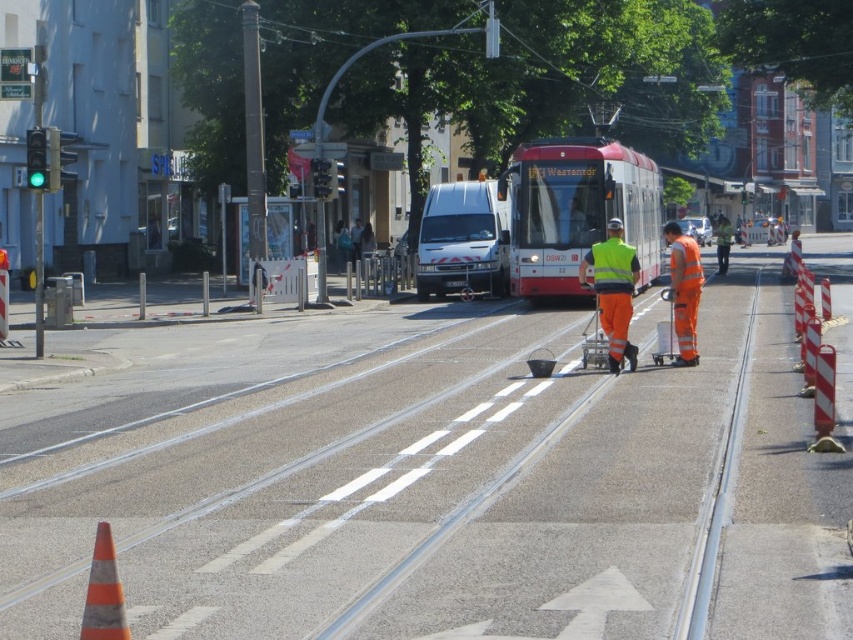
Question: Is the position of orange reflective workwear at center more distant than that of metallic silver trolley at center?

Choices:
 (A) no
 (B) yes

Answer: (A)

Question: Which object appears closest to the camera in this image?

Choices:
 (A) orange striped cone at lower left
 (B) high visibility orange reflective pants at center
 (C) yellow reflective safety vest at center

Answer: (A)

Question: Which point appears farthest from the camera in this image?

Choices:
 (A) (686, 301)
 (B) (94, 589)
 (C) (660, 344)
 (D) (583, 340)

Answer: (D)

Question: Among these objects, which one is farthest from the camera?

Choices:
 (A) high visibility orange reflective pants at center
 (B) orange reflective workwear at center
 (C) metallic silver trolley at center

Answer: (C)

Question: Can you confirm if orange striped cone at lower left is wider than yellow reflective safety vest at center?

Choices:
 (A) no
 (B) yes

Answer: (A)

Question: Does orange striped cone at lower left have a smaller size compared to orange reflective workwear at center?

Choices:
 (A) yes
 (B) no

Answer: (A)